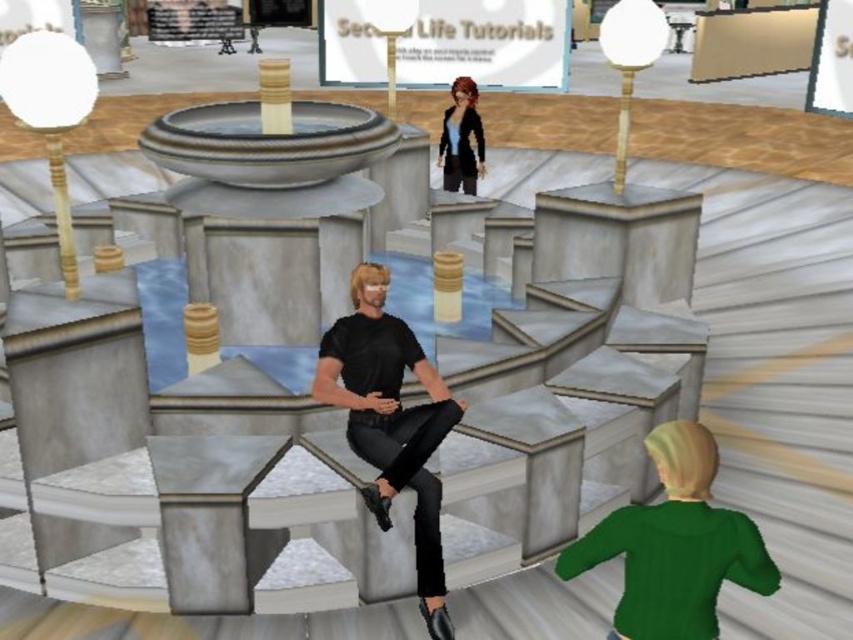
Question: Can you confirm if green matte sweater at lower right is positioned above black matte pants at center?

Choices:
 (A) no
 (B) yes

Answer: (A)

Question: Can you confirm if black matte pants at center is positioned to the left of matte black jacket at upper center?

Choices:
 (A) yes
 (B) no

Answer: (A)

Question: Can you confirm if black matte pants at center is thinner than matte black jacket at upper center?

Choices:
 (A) no
 (B) yes

Answer: (A)

Question: Among these objects, which one is farthest from the camera?

Choices:
 (A) green matte sweater at lower right
 (B) black matte pants at center

Answer: (B)

Question: Which object appears farthest from the camera in this image?

Choices:
 (A) matte black jacket at upper center
 (B) black matte pants at center
 (C) green matte sweater at lower right

Answer: (A)

Question: Estimate the real-world distances between objects in this image. Which object is farther from the matte black jacket at upper center?

Choices:
 (A) green matte sweater at lower right
 (B) black matte pants at center

Answer: (A)